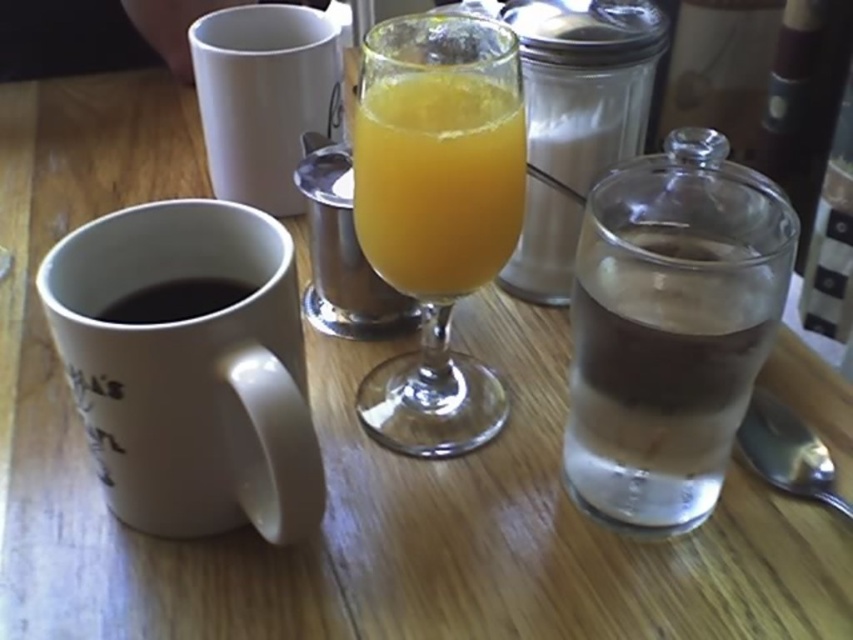
Measure the distance from clear glass water at right to translucent glass at center.

clear glass water at right and translucent glass at center are 3.16 inches apart from each other.

Who is positioned more to the left, clear glass water at right or translucent glass at center?

From the viewer's perspective, translucent glass at center appears more on the left side.

Where is `clear glass water at right`? clear glass water at right is located at coordinates (669, 332).

At what (x,y) coordinates should I click in order to perform the action: click on clear glass water at right. Please return your answer as a coordinate pair (x, y). Looking at the image, I should click on (669, 332).

Is white matte mug at left below translucent glass at center?

Indeed, white matte mug at left is positioned under translucent glass at center.

Who is taller, white matte mug at left or translucent glass at center?

white matte mug at left

Between point (53, 284) and point (479, 244), which one is positioned behind?

The point (479, 244) is more distant.

The height and width of the screenshot is (640, 853). In order to click on white matte mug at left in this screenshot , I will do `click(189, 371)`.

Between white matte mug at left and black matte mug at left, which one has less height?

black matte mug at left is shorter.

Is white matte mug at left wider than black matte mug at left?

Correct, the width of white matte mug at left exceeds that of black matte mug at left.

The width and height of the screenshot is (853, 640). What do you see at coordinates (189, 371) in the screenshot?
I see `white matte mug at left` at bounding box center [189, 371].

Image resolution: width=853 pixels, height=640 pixels. I want to click on white matte mug at left, so click(189, 371).